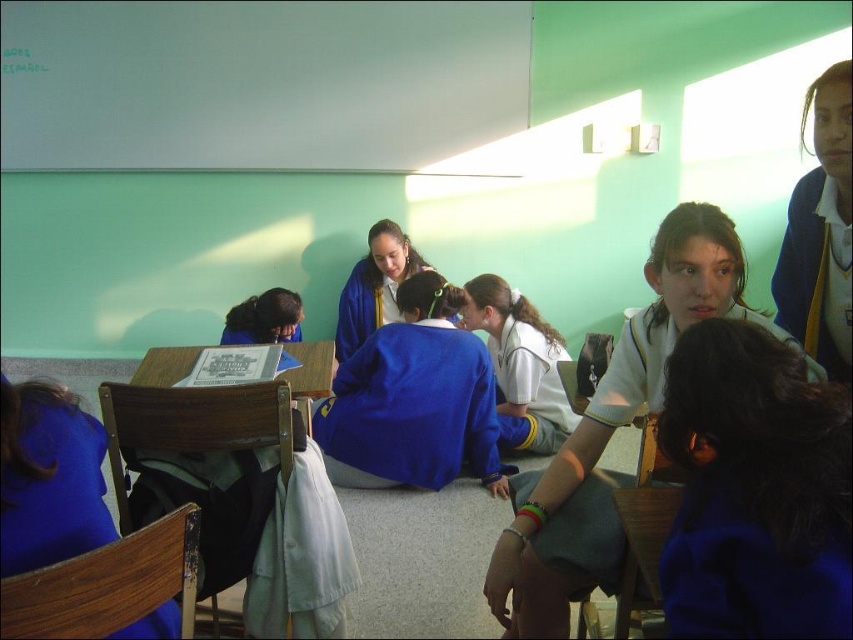
Can you confirm if white jersey at center is smaller than blue fabric jacket at center?

No, white jersey at center is not smaller than blue fabric jacket at center.

Is point (824, 376) positioned before point (422, 352)?

Yes, point (824, 376) is in front of point (422, 352).

Is point (520, 557) farther from camera compared to point (447, 298)?

No, (520, 557) is closer to viewer.

Find the location of a particular element. The height and width of the screenshot is (640, 853). white jersey at center is located at coordinates (614, 429).

Consider the image. Between blue fabric jacket at center and blue fabric jacket at upper right, which one has more height?

Standing taller between the two is blue fabric jacket at center.

The image size is (853, 640). What are the coordinates of `blue fabric jacket at center` in the screenshot? It's located at (413, 401).

What do you see at coordinates (413, 401) in the screenshot? I see `blue fabric jacket at center` at bounding box center [413, 401].

Locate an element on the screen. This screenshot has height=640, width=853. blue fabric jacket at center is located at coordinates click(x=413, y=401).

Is blue fabric at center closer to the viewer compared to blue fabric jacket at center?

Yes, blue fabric at center is closer to the viewer.

Which of these two, blue fabric at center or blue fabric jacket at center, stands shorter?

blue fabric at center

This screenshot has height=640, width=853. In order to click on blue fabric at center in this screenshot , I will do `click(753, 490)`.